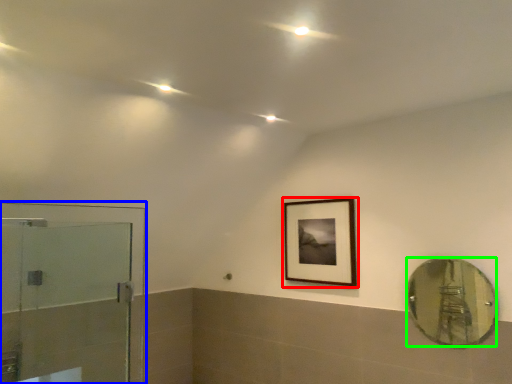
Question: Based on their relative distances, which object is farther from picture frame (highlighted by a red box)? Choose from screen door (highlighted by a blue box) and mirror (highlighted by a green box).

Choices:
 (A) screen door
 (B) mirror

Answer: (A)